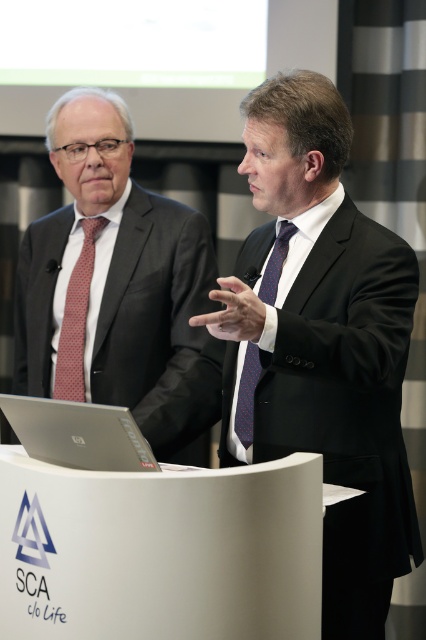
Does point (388, 388) come farther from viewer compared to point (131, 435)?

Yes, point (388, 388) is behind point (131, 435).

Who is more distant from viewer, (247, 289) or (39, 458)?

The point (247, 289) is behind.

This screenshot has height=640, width=426. I want to click on matte black suit at center, so click(322, 340).

This screenshot has height=640, width=426. What are the coordinates of `matte black suit at center` in the screenshot? It's located at (322, 340).

Can you confirm if matte black suit at center is taller than red dotted tie at left?

Indeed, matte black suit at center has a greater height compared to red dotted tie at left.

Is matte black suit at center positioned behind red dotted tie at left?

No, matte black suit at center is in front of red dotted tie at left.

Is point (319, 193) closer to camera compared to point (69, 353)?

Yes, it is in front of point (69, 353).

Identify the location of matte black suit at center. The image size is (426, 640). (322, 340).

Which of these two, white matte podium at center or red dotted tie at left, stands shorter?

white matte podium at center

Does white matte podium at center have a lesser height compared to red dotted tie at left?

Yes.

Where is `white matte podium at center`? Image resolution: width=426 pixels, height=640 pixels. white matte podium at center is located at coordinates (161, 552).